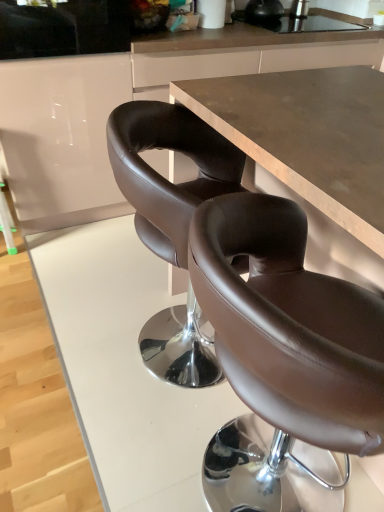
Question: Is brown matte counter at center in front of or behind white glossy cabinet at upper left in the image?

Choices:
 (A) front
 (B) behind

Answer: (B)

Question: From the image's perspective, relative to white glossy cabinet at upper left, is brown matte counter at center above or below?

Choices:
 (A) above
 (B) below

Answer: (A)

Question: Estimate the real-world distances between objects in this image. Which object is closer to the white glossy cabinet at upper left?

Choices:
 (A) brown leather chair at center
 (B) brown matte counter at center
 (C) brown leather bar stool at left

Answer: (B)

Question: Which object is the farthest from the brown leather bar stool at left?

Choices:
 (A) brown matte counter at center
 (B) white glossy cabinet at upper left
 (C) brown leather chair at center

Answer: (C)